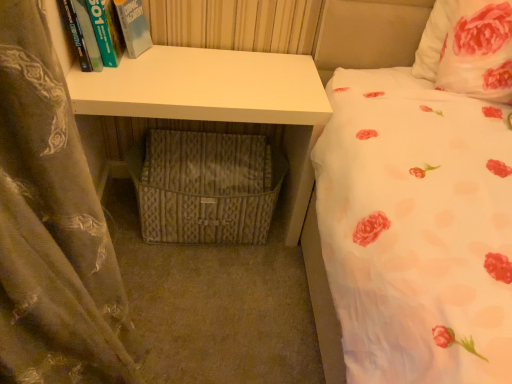
What are the coordinates of `free space in front of hardcover book at upper left` in the screenshot? It's located at tap(108, 90).